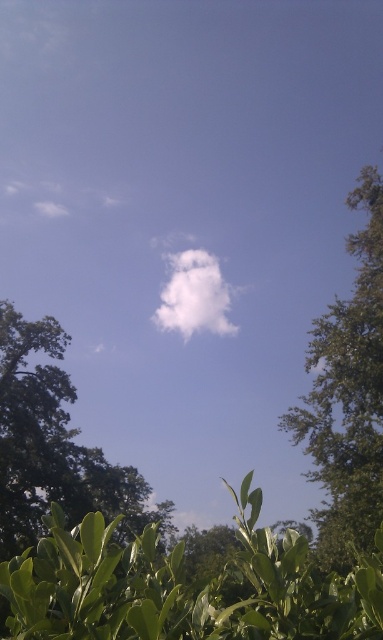
Does green leafy tree at right have a greater height compared to green leafy tree at lower left?

Incorrect, green leafy tree at right's height is not larger of green leafy tree at lower left's.

Can you confirm if green leafy tree at right is smaller than green leafy tree at lower left?

Yes.

Who is more forward, (x=345, y=244) or (x=39, y=412)?

Point (x=345, y=244) is more forward.

The height and width of the screenshot is (640, 383). Find the location of `green leafy tree at right`. green leafy tree at right is located at coordinates (348, 396).

Can you confirm if green leafy tree at lower left is wider than white fluffy cloud at center?

No, green leafy tree at lower left is not wider than white fluffy cloud at center.

Is green leafy tree at lower left closer to camera compared to white fluffy cloud at center?

Yes, green leafy tree at lower left is in front of white fluffy cloud at center.

Is point (78, 512) closer to camera compared to point (191, 320)?

Yes, it is.

Where is `green leafy tree at lower left`? The height and width of the screenshot is (640, 383). green leafy tree at lower left is located at coordinates (54, 445).

Can you confirm if green leafy tree at right is shorter than white fluffy cloud at center?

No.

Which is in front, point (360, 467) or point (214, 326)?

Point (360, 467) is more forward.

The width and height of the screenshot is (383, 640). In order to click on green leafy tree at right in this screenshot , I will do `click(348, 396)`.